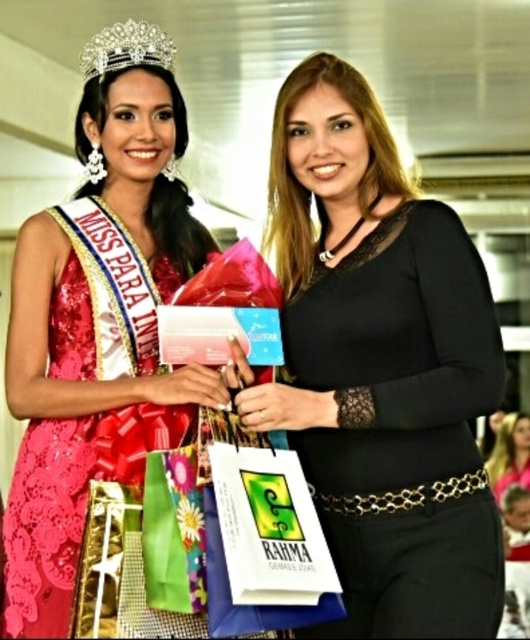
In the scene shown: You are a photographer at a formal event. You need to capture a closeup shot of the black lace top at center and the smooth black dress at center. Based on their widths, which one should you focus on first to ensure it fits within the frame?

The black lace top at center is wider than the smooth black dress at center, so you should focus on capturing the black lace top at center first to ensure it fits within the frame.

You are at a formal event and see two women. The woman on the left is wearing a red lace dress with a crown and holding gift bags with a RAHMA logo. The woman on the right is wearing a black lace top with gold belt. There is a point marked at coordinates (381, 368). What object does this point correspond to?

The point at coordinates (381, 368) corresponds to the black lace top at center.